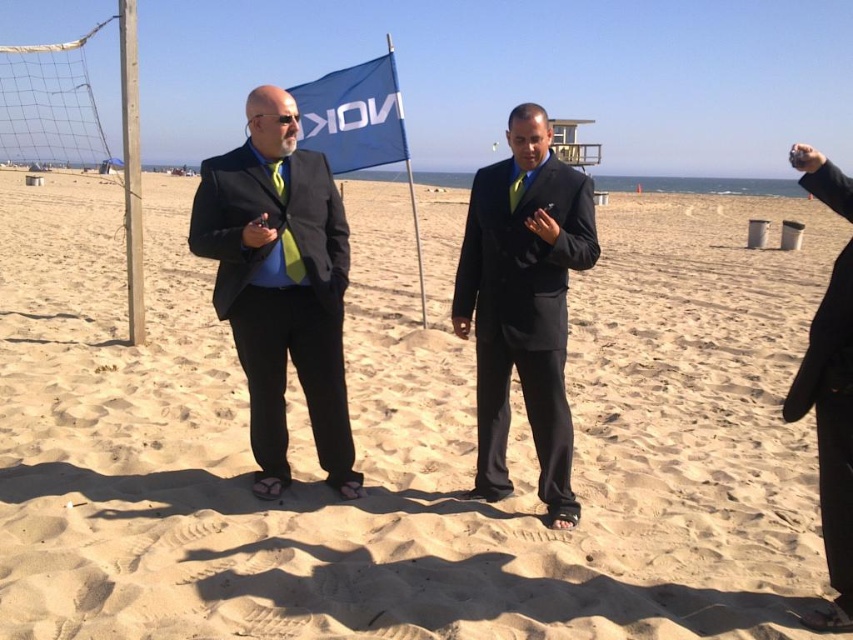
Between matte black suit at left and black matte suit at right, which one has less height?

With less height is black matte suit at right.

Can you confirm if matte black suit at left is positioned to the right of black matte suit at right?

Incorrect, matte black suit at left is not on the right side of black matte suit at right.

What are the coordinates of `matte black suit at left` in the screenshot? It's located at (280, 284).

At what (x,y) coordinates should I click in order to perform the action: click on matte black suit at left. Please return your answer as a coordinate pair (x, y). Looking at the image, I should click on (280, 284).

Based on the photo, is matte black suit at center shorter than blue fabric flag at center?

No.

What do you see at coordinates (523, 304) in the screenshot? The image size is (853, 640). I see `matte black suit at center` at bounding box center [523, 304].

Locate an element on the screen. matte black suit at center is located at coordinates (523, 304).

Which of these two, matte black suit at left or matte black suit at center, stands shorter?

matte black suit at center is shorter.

Does matte black suit at left have a larger size compared to matte black suit at center?

Correct, matte black suit at left is larger in size than matte black suit at center.

Image resolution: width=853 pixels, height=640 pixels. I want to click on matte black suit at left, so click(280, 284).

This screenshot has width=853, height=640. Identify the location of matte black suit at left. (280, 284).